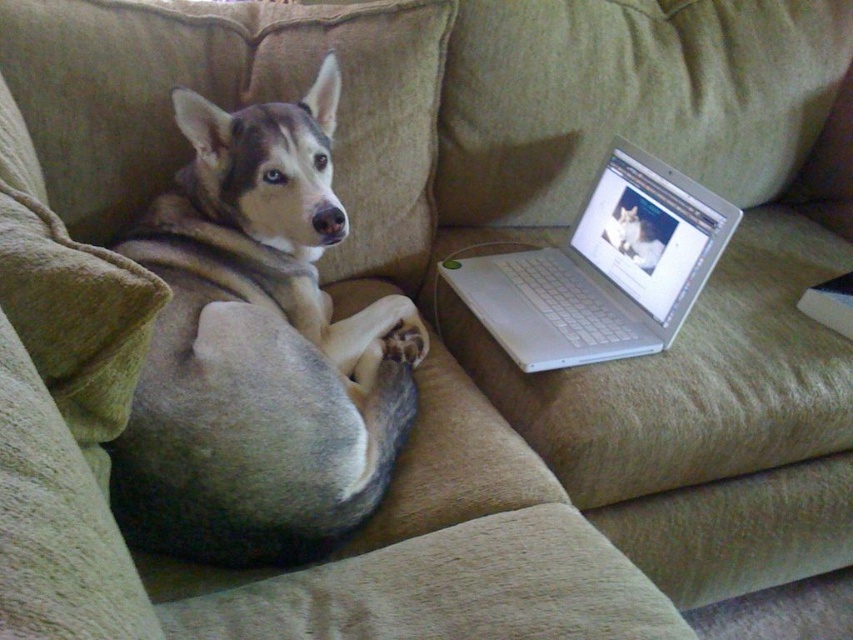
Is brown fur dog at left further to camera compared to silver metallic laptop at right?

No, brown fur dog at left is closer to the viewer.

Does brown fur dog at left have a smaller size compared to silver metallic laptop at right?

Incorrect, brown fur dog at left is not smaller in size than silver metallic laptop at right.

Find the location of `brown fur dog at left`. brown fur dog at left is located at coordinates (258, 349).

This screenshot has height=640, width=853. In order to click on brown fur dog at left in this screenshot , I will do `click(258, 349)`.